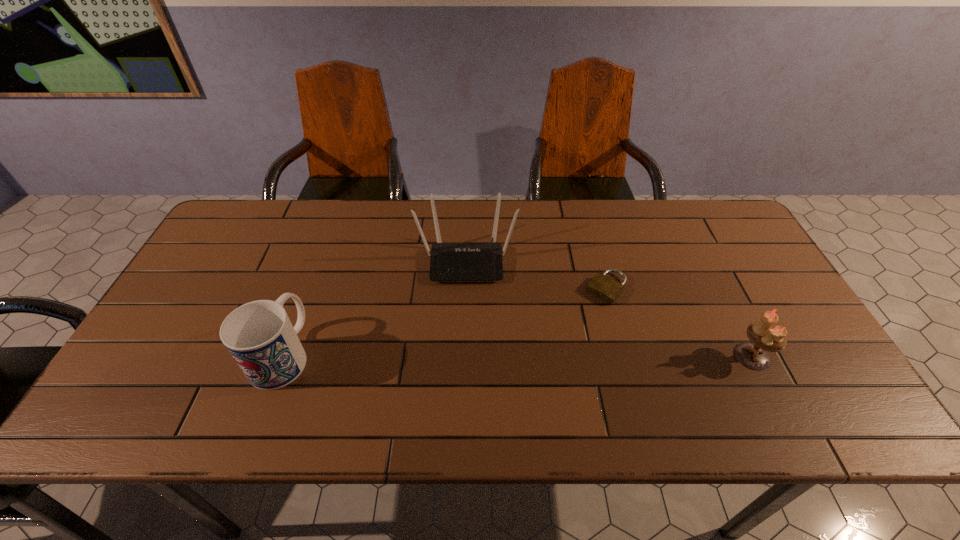
Identify the location of vacant space located on the front-facing side of the router. (467, 347).

Find the location of a particular element. vacant space located on the front-facing side of the router is located at coordinates (467, 331).

In order to click on vacant space located 0.270m on the front-facing side of the router in this screenshot , I will do `click(466, 368)`.

At what (x,y) coordinates should I click in order to perform the action: click on object that is at the far edge. Please return your answer as a coordinate pair (x, y). Looking at the image, I should click on (481, 261).

Where is `mug that is at the near edge`? The image size is (960, 540). mug that is at the near edge is located at coordinates (259, 335).

You are a GUI agent. You are given a task and a screenshot of the screen. Output one action in this format:
    pyautogui.click(x=<x>, y=<y>)
    Task: Click on the candle holder located at the near edge
    The height and width of the screenshot is (540, 960).
    Given the screenshot: What is the action you would take?
    pyautogui.click(x=764, y=336)

Locate an element on the screen. This screenshot has height=540, width=960. object situated at the right edge is located at coordinates point(764,336).

Find the location of a particular element. The width and height of the screenshot is (960, 540). object located in the near right corner section of the desktop is located at coordinates (764, 336).

I want to click on vacant space at the far edge, so click(x=607, y=219).

In the image, there is a desktop. Identify the location of vacant space at the near edge. Image resolution: width=960 pixels, height=540 pixels. (415, 376).